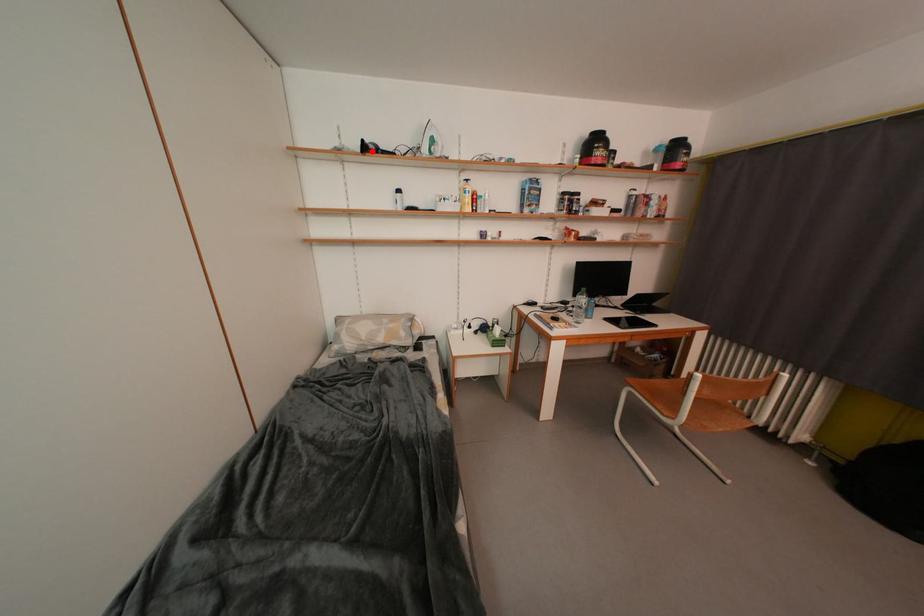
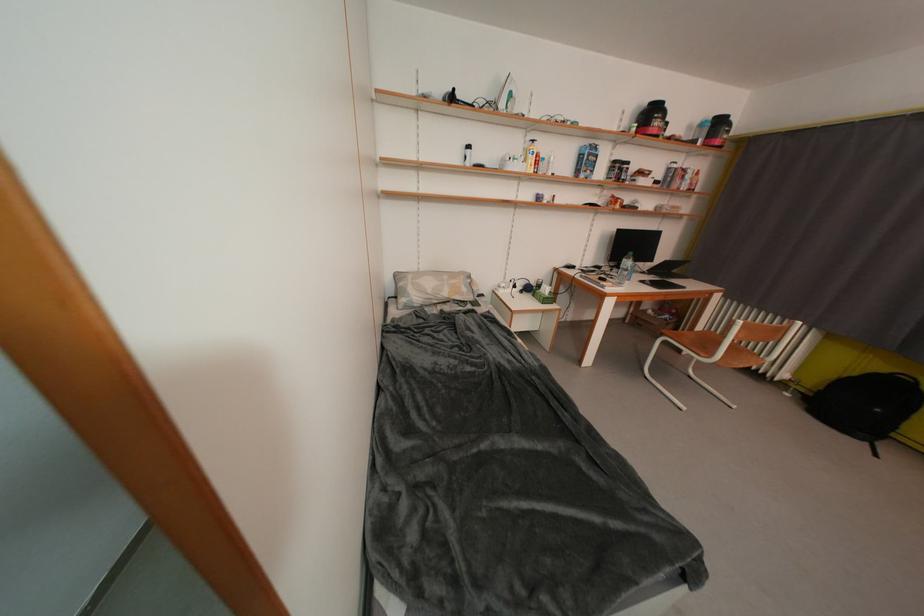
In the second image, find the point that corresponds to the highlighted location in the first image.

(459, 100)